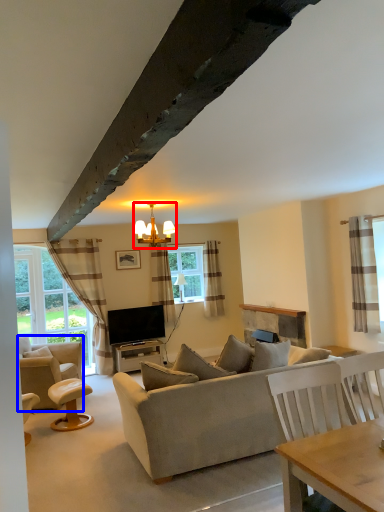
Question: Which point is further to the camera, lamp (highlighted by a red box) or chair (highlighted by a blue box)?

Choices:
 (A) lamp
 (B) chair

Answer: (B)